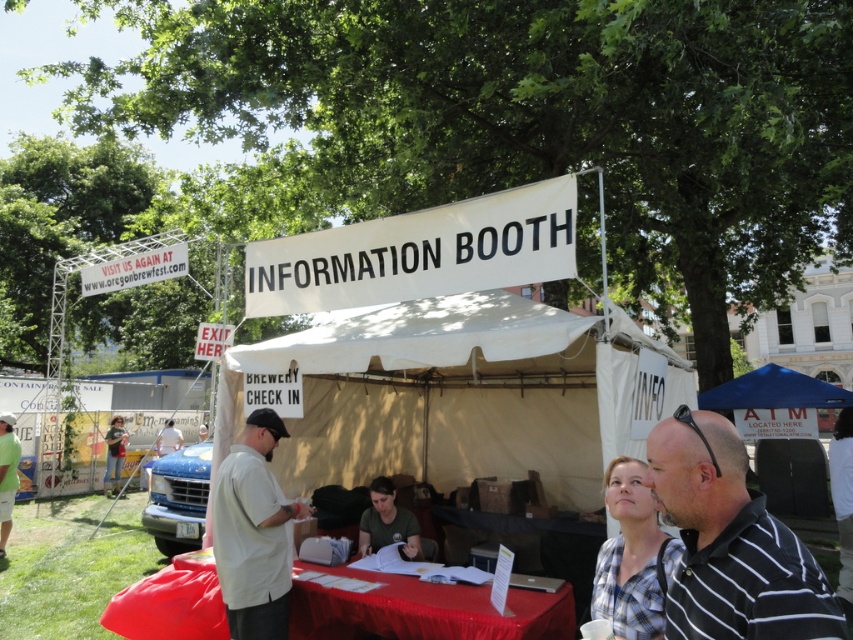
You are standing at the entrance of the event and want to locate the smooth red tablecloth at center. According to the coordinates given, where would you find it in the image?

The smooth red tablecloth at center is located at the coordinates point (424, 611) in the image.

You are at the information booth and need to locate the smooth red tablecloth at center and the matte green shirt at center. From the perspective of someone standing at the booth, which object is positioned to the left?

The matte green shirt at center is to the left of the smooth red tablecloth at center, so the matte green shirt at center is positioned to the left.